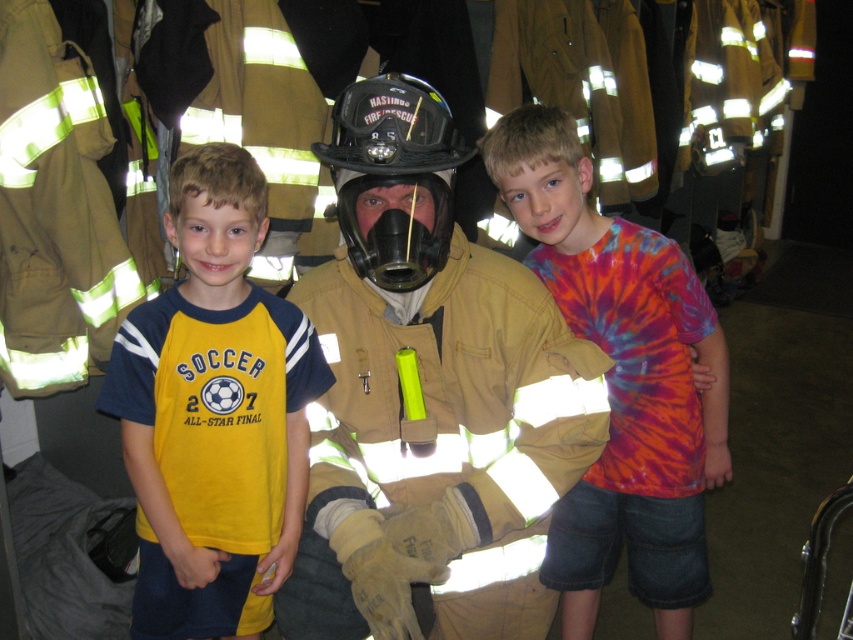
Question: Observing the image, what is the correct spatial positioning of matte yellow fireman at center in reference to tie-dye fabric shirt at center?

Choices:
 (A) left
 (B) right

Answer: (A)

Question: Where is matte yellow fireman at center located in relation to black matte helmet at center in the image?

Choices:
 (A) above
 (B) below

Answer: (B)

Question: Can you confirm if matte yellow fireman at center is thinner than tie-dye fabric shirt at center?

Choices:
 (A) no
 (B) yes

Answer: (B)

Question: Estimate the real-world distances between objects in this image. Which object is farther from the yellow fabric shirt at left?

Choices:
 (A) black matte helmet at center
 (B) matte yellow fireman at center

Answer: (A)

Question: Which of the following is the closest to the observer?

Choices:
 (A) yellow fabric shirt at left
 (B) matte yellow fireman at center
 (C) tie-dye fabric shirt at center
 (D) black matte helmet at center

Answer: (B)

Question: Which is farther from the yellow fabric shirt at left?

Choices:
 (A) matte yellow fireman at center
 (B) tie-dye fabric shirt at center

Answer: (B)